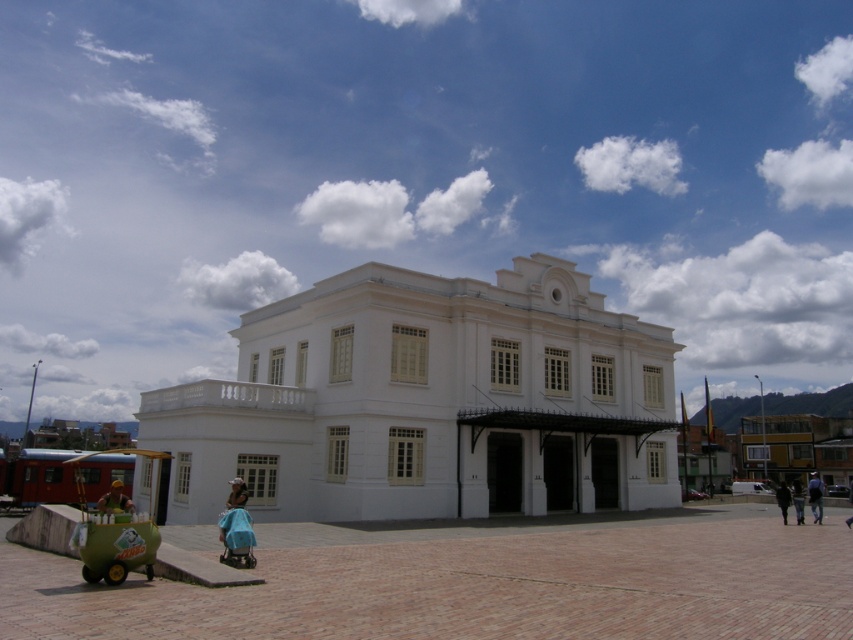
Question: Which point appears closest to the camera in this image?

Choices:
 (A) [x=808, y=492]
 (B) [x=106, y=500]
 (C) [x=236, y=525]

Answer: (B)

Question: Observing the image, what is the correct spatial positioning of blue denim jeans at lower right in reference to dark blue fabric at lower right?

Choices:
 (A) above
 (B) below

Answer: (A)

Question: Is blue satin dress at lower center closer to the viewer compared to blue denim jeans at lower right?

Choices:
 (A) yes
 (B) no

Answer: (A)

Question: Which point appears farthest from the camera in this image?

Choices:
 (A) (112, 486)
 (B) (784, 504)
 (C) (810, 506)
 (D) (224, 547)

Answer: (A)

Question: Which object is the farthest from the dark blue fabric at lower right?

Choices:
 (A) blue denim jeans at lower right
 (B) blue satin dress at lower center
 (C) green fabric umbrella at lower left

Answer: (C)

Question: Is green fabric umbrella at lower left thinner than dark blue fabric at lower right?

Choices:
 (A) no
 (B) yes

Answer: (B)